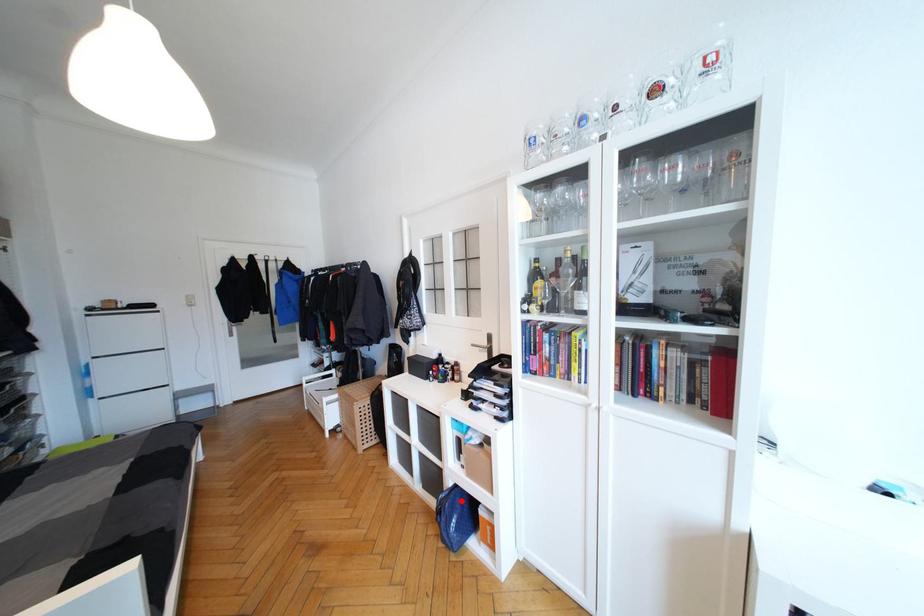
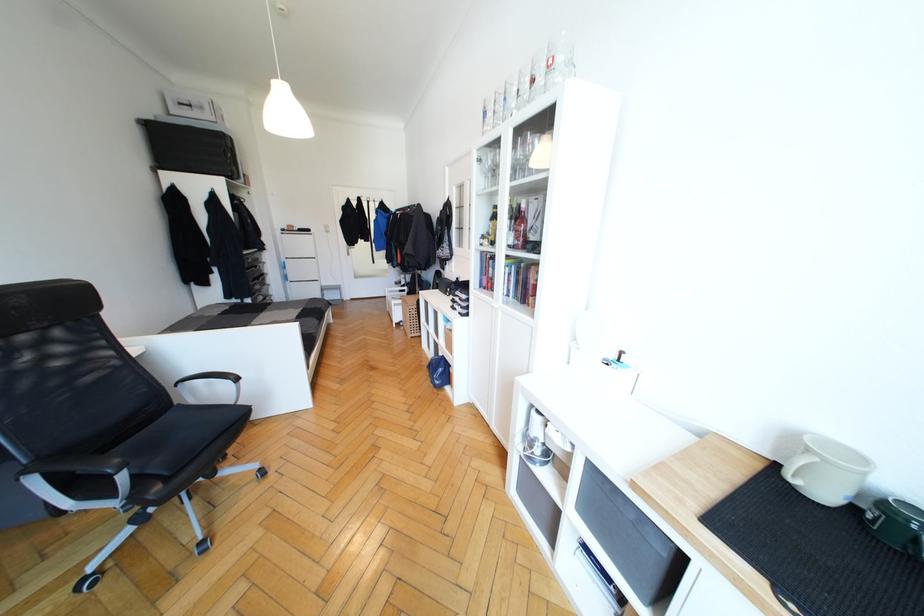
Find the pixel in the second image that matches the highlighted location in the first image.

(445, 363)